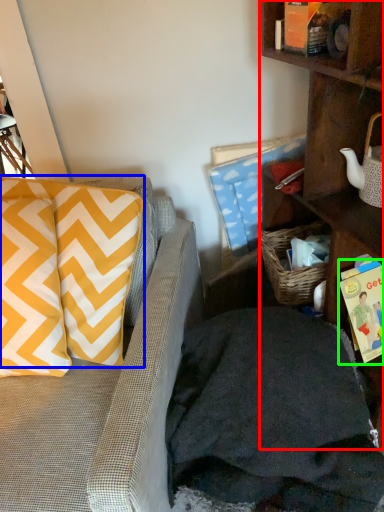
Question: Based on their relative distances, which object is farther from shelf (highlighted by a red box)? Choose from pillow (highlighted by a blue box) and book (highlighted by a green box).

Choices:
 (A) pillow
 (B) book

Answer: (A)